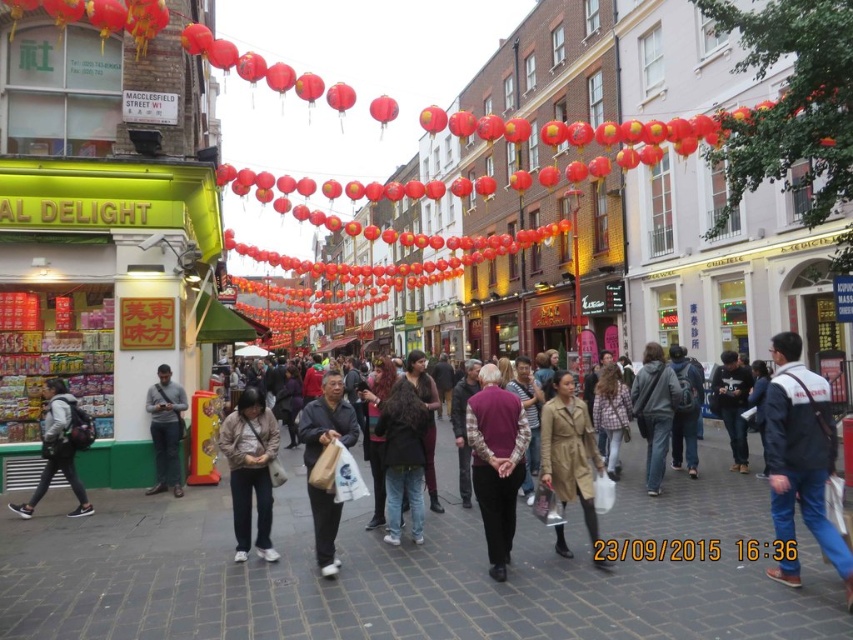
You are a pedestrian standing on Macclesfield Street W1 and you see a matte black backpack at lower left and a dark gray hoodie at center. Which object is closer to the ground?

The matte black backpack at lower left is located below the dark gray hoodie at center, so it is closer to the ground.

Based on the coordinates provided, what object is located at point [569,451] in the scene?

The tan leather coat at center is located at point [569,451].

From the picture: You are a photographer trying to capture a shot of the vibrant red lanterns without any obstructions. You notice a matte black backpack at lower left and a dark gray hoodie at center in your frame. Which object is shorter and might be less likely to block your view of the lanterns?

The matte black backpack at lower left has a lesser height compared to the dark gray hoodie at center, so it is shorter and less likely to block your view of the lanterns.